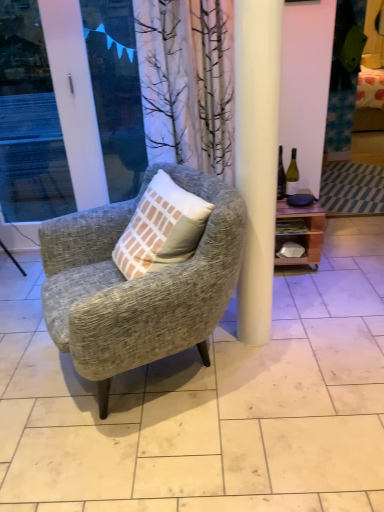
Question: Is textured gray armchair at center further to the viewer compared to white glossy screen door at left?

Choices:
 (A) no
 (B) yes

Answer: (A)

Question: Is textured gray armchair at center turned away from white glossy screen door at left?

Choices:
 (A) no
 (B) yes

Answer: (A)

Question: From a real-world perspective, is textured gray armchair at center positioned over white glossy screen door at left based on gravity?

Choices:
 (A) yes
 (B) no

Answer: (B)

Question: Is textured gray armchair at center in front of white glossy screen door at left?

Choices:
 (A) no
 (B) yes

Answer: (B)

Question: Is textured gray armchair at center positioned beyond the bounds of white glossy screen door at left?

Choices:
 (A) yes
 (B) no

Answer: (A)

Question: Choose the correct answer: Is textured gray armchair at center inside wooden shelf at right or outside it?

Choices:
 (A) outside
 (B) inside

Answer: (A)

Question: Looking at their shapes, would you say textured gray armchair at center is wider or thinner than wooden shelf at right?

Choices:
 (A) wide
 (B) thin

Answer: (A)

Question: Considering their positions, is textured gray armchair at center located in front of or behind wooden shelf at right?

Choices:
 (A) front
 (B) behind

Answer: (A)

Question: Considering the positions of textured gray armchair at center and wooden shelf at right in the image, is textured gray armchair at center bigger or smaller than wooden shelf at right?

Choices:
 (A) big
 (B) small

Answer: (A)

Question: Considering the positions of textured gray armchair at center and green glass bottle at right in the image, is textured gray armchair at center taller or shorter than green glass bottle at right?

Choices:
 (A) short
 (B) tall

Answer: (B)

Question: From a real-world perspective, is textured gray armchair at center positioned above or below green glass bottle at right?

Choices:
 (A) above
 (B) below

Answer: (B)

Question: Is point (100, 353) closer or farther from the camera than point (291, 159)?

Choices:
 (A) farther
 (B) closer

Answer: (B)

Question: From the image's perspective, is textured gray armchair at center located above or below green glass bottle at right?

Choices:
 (A) above
 (B) below

Answer: (B)

Question: From a real-world perspective, is white glossy screen door at left above or below textured gray armchair at center?

Choices:
 (A) below
 (B) above

Answer: (B)

Question: Choose the correct answer: Is white glossy screen door at left inside textured gray armchair at center or outside it?

Choices:
 (A) inside
 (B) outside

Answer: (B)